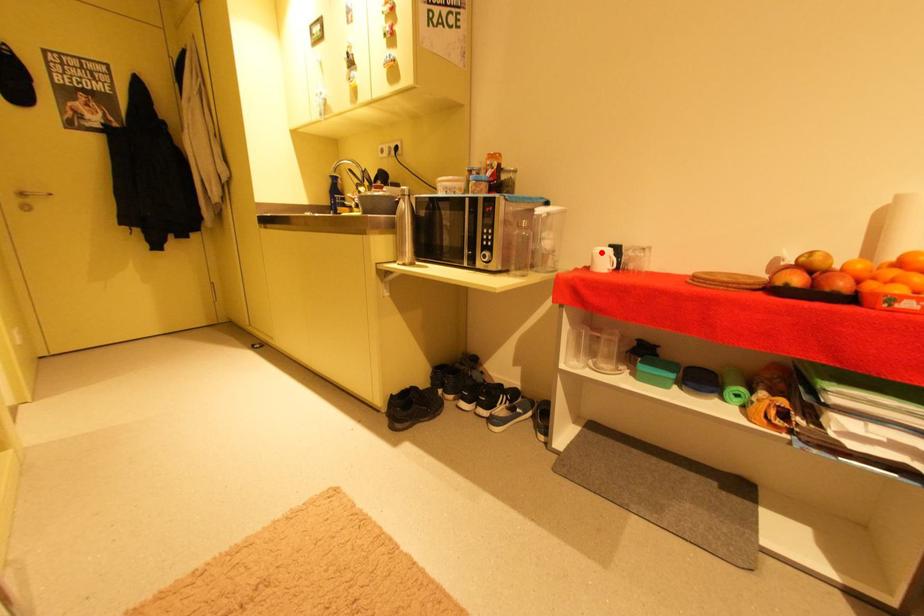
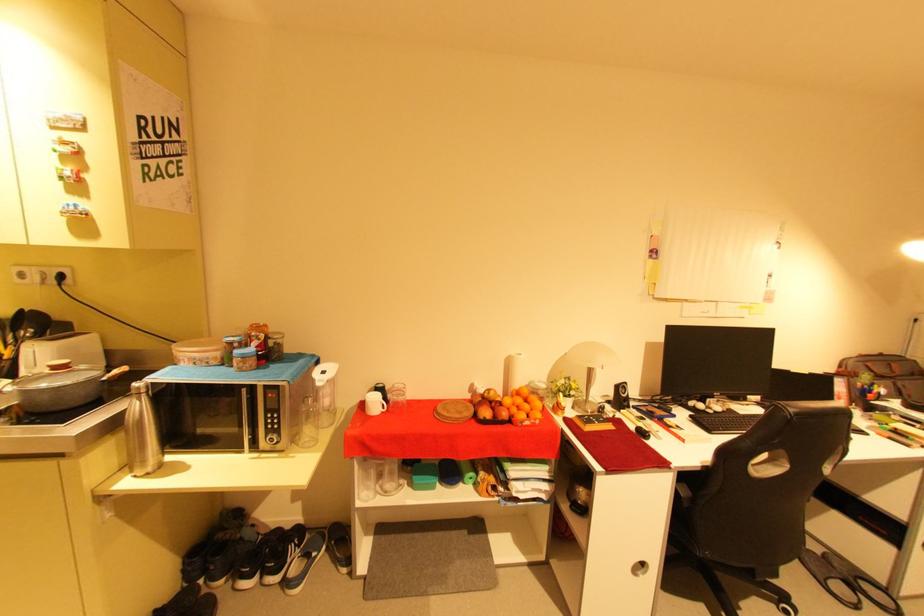
In the second image, find the point that corresponds to the highlighted location in the first image.

(374, 400)